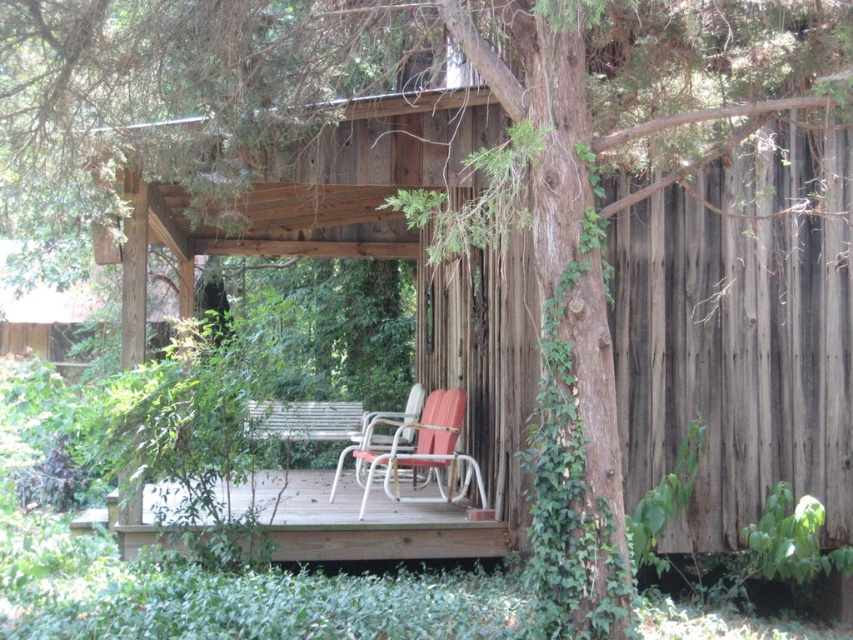
You are standing on the wooden deck at center and want to move towards the metallic silver chair at center. Which direction should you move to get closer to the chair?

Since the wooden deck at center is closer to the viewer than the metallic silver chair at center, you should move backward to get closer to the metallic silver chair at center.

You are standing on the deck and want to place a small potted plant between the two points marked as point (431, 470) and point (358, 436). Which point should the plant be closer to if you want it to be nearer to the viewer?

The plant should be placed closer to point (431, 470) because it is closer to the viewer than point (358, 436).

You are standing on the wooden deck at center. If you look directly ahead, what do you see in the immediate foreground?

The wooden deck at center is located at point [363,522], so the immediate foreground would be the wooden deck itself since you are standing on it.